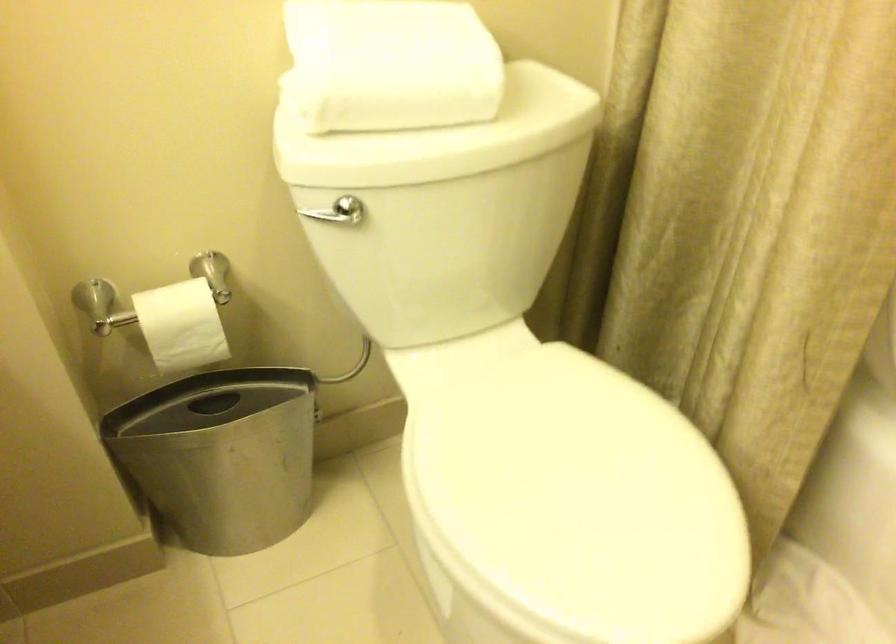
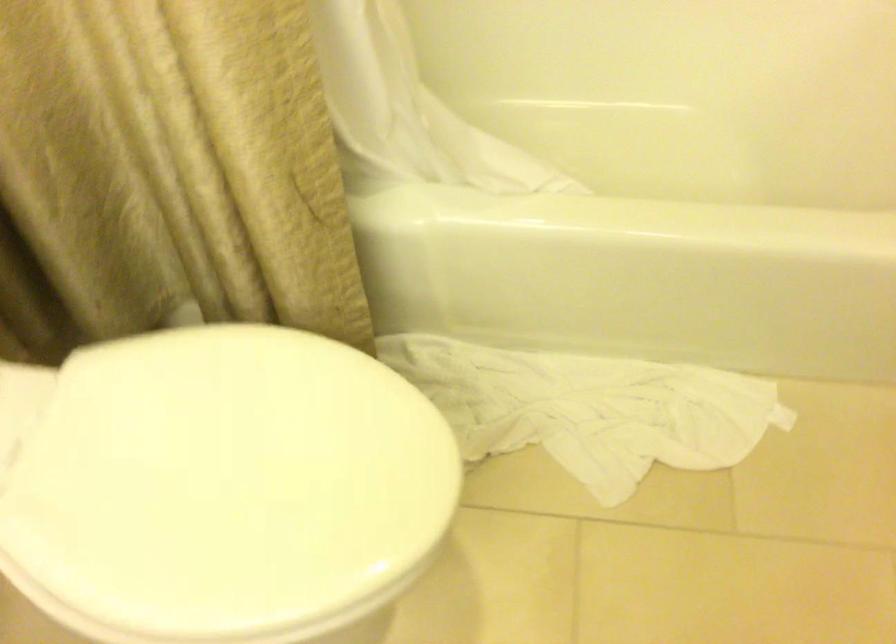
The point at [552,489] is marked in the first image. Where is the corresponding point in the second image?

(219, 484)